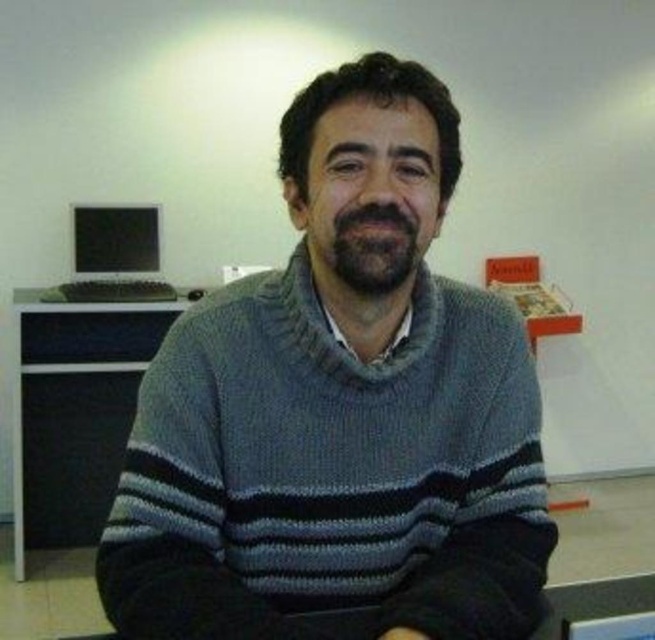
You are organizing a small event and need to place a 12 cm tall figurine on either the black plastic table at left or the matte black monitor at left. Based on their heights, which surface can safely accommodate the figurine without it exceeding the height limit?

The black plastic table at left has a greater height compared to the matte black monitor at left, so the figurine can be safely placed on the black plastic table at left as it is taller and provides more vertical space.

You are an interior designer assessing the placement of furniture in the scene. The gray knitted sweater at center and the matte black monitor at left are both in view. Which object is located lower in the image?

The gray knitted sweater at center is positioned under the matte black monitor at left, so it is located lower in the image.

You are standing in the office scene described. You need to place a 3.5 meter long ladder in the room. Is there enough space between you and the black plastic table at left to fit the ladder horizontally?

The black plastic table at left is 2.82 meters away from the viewer. Since the ladder is 3.5 meters long, it would not fit as the distance available is shorter than the ladder length.